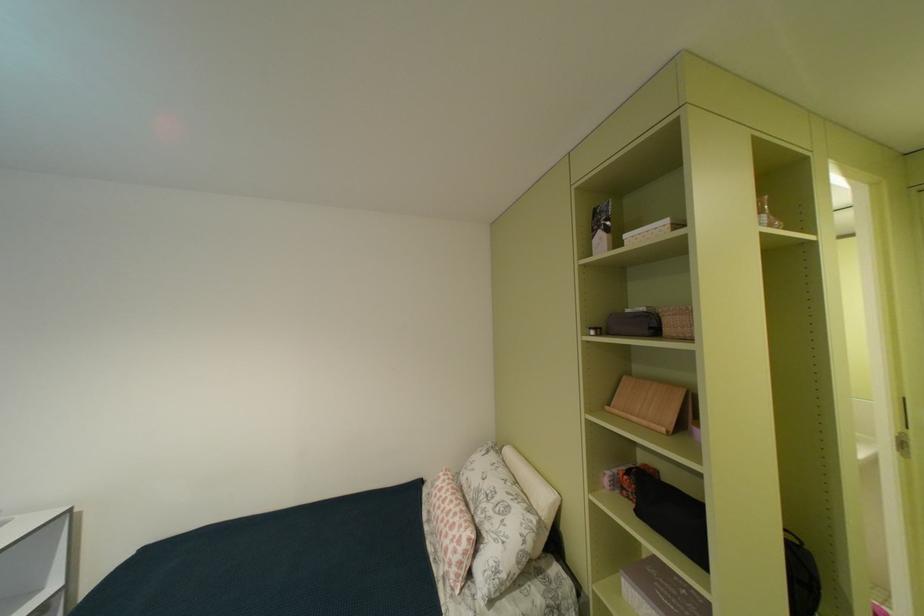
What are the coordinates of `pink patterned pillow` in the screenshot? It's located at (451, 529).